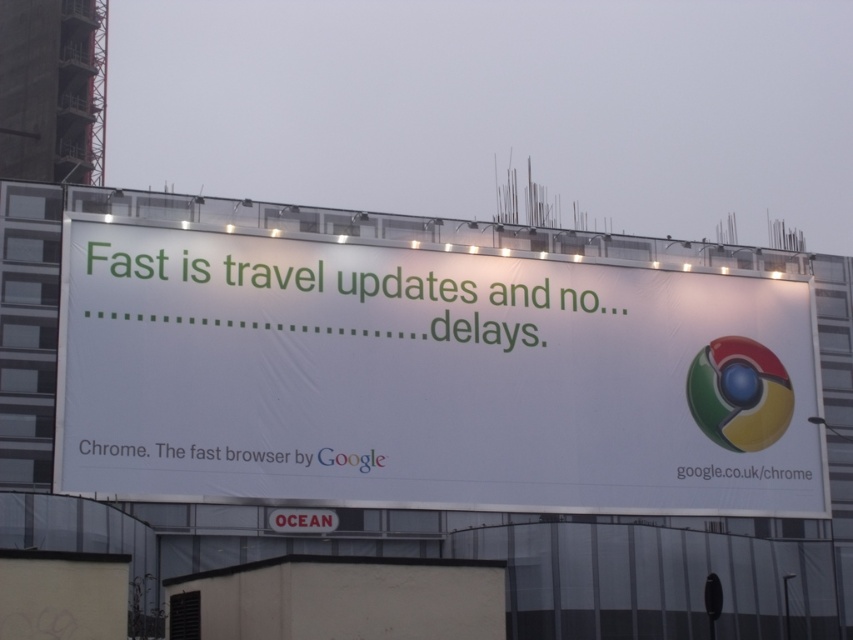
Question: Is white paper billboard at center positioned in front of shiny chrome beach ball at right?

Choices:
 (A) no
 (B) yes

Answer: (B)

Question: Can you confirm if white paper billboard at center is positioned to the left of shiny chrome beach ball at right?

Choices:
 (A) yes
 (B) no

Answer: (A)

Question: Can you confirm if white paper billboard at center is positioned above shiny chrome beach ball at right?

Choices:
 (A) no
 (B) yes

Answer: (B)